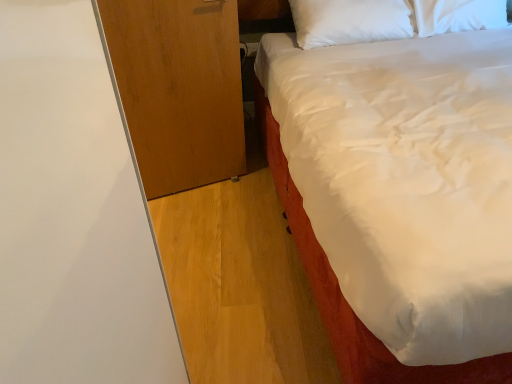
Question: Is the depth of wooden dresser at left less than that of white satin bed at upper right?

Choices:
 (A) yes
 (B) no

Answer: (B)

Question: Is wooden dresser at left wider than white satin bed at upper right?

Choices:
 (A) yes
 (B) no

Answer: (B)

Question: From a real-world perspective, is wooden dresser at left on white satin bed at upper right?

Choices:
 (A) yes
 (B) no

Answer: (B)

Question: From a real-world perspective, is wooden dresser at left below white satin bed at upper right?

Choices:
 (A) yes
 (B) no

Answer: (A)

Question: Can you confirm if wooden dresser at left is positioned to the left of white satin bed at upper right?

Choices:
 (A) yes
 (B) no

Answer: (A)

Question: Is wooden dresser at left not within white satin bed at upper right?

Choices:
 (A) no
 (B) yes

Answer: (B)

Question: Can you confirm if white satin bed at upper right is positioned to the right of wooden dresser at left?

Choices:
 (A) yes
 (B) no

Answer: (A)

Question: Considering the relative sizes of white satin bed at upper right and wooden dresser at left in the image provided, is white satin bed at upper right wider than wooden dresser at left?

Choices:
 (A) no
 (B) yes

Answer: (B)

Question: Does white satin bed at upper right come behind wooden dresser at left?

Choices:
 (A) yes
 (B) no

Answer: (B)

Question: Does white satin bed at upper right have a lesser width compared to wooden dresser at left?

Choices:
 (A) yes
 (B) no

Answer: (B)

Question: From the image's perspective, does white satin bed at upper right appear higher than wooden dresser at left?

Choices:
 (A) yes
 (B) no

Answer: (A)

Question: Does white satin bed at upper right have a lesser height compared to wooden dresser at left?

Choices:
 (A) yes
 (B) no

Answer: (B)

Question: From a real-world perspective, relative to white satin bed at upper right, is wooden dresser at left vertically above or below?

Choices:
 (A) below
 (B) above

Answer: (A)